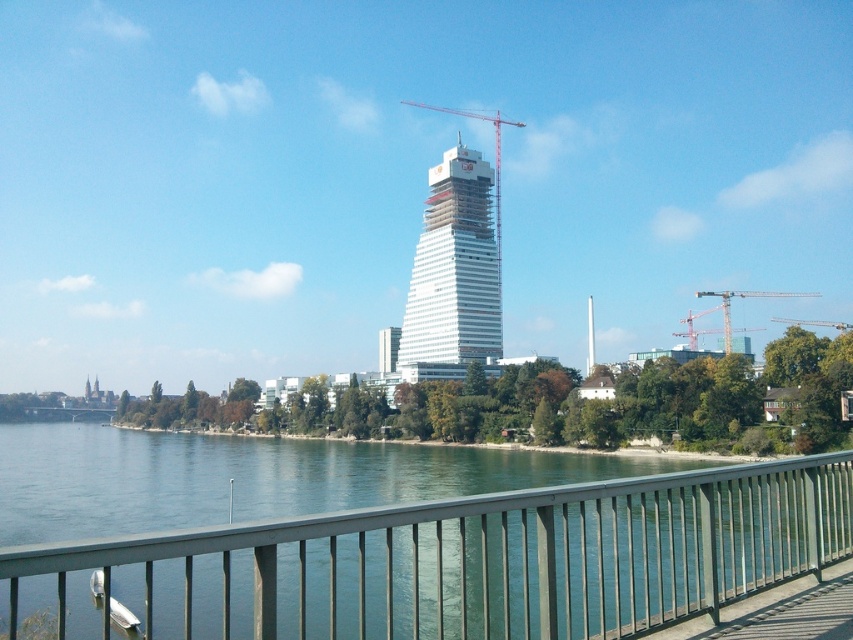
Question: Is metallic gray railing at lower center to the right of white glass building at center from the viewer's perspective?

Choices:
 (A) yes
 (B) no

Answer: (B)

Question: Among these points, which one is farthest from the camera?

Choices:
 (A) (695, 296)
 (B) (792, 468)
 (C) (447, 362)

Answer: (A)

Question: Which object appears farthest from the camera in this image?

Choices:
 (A) white glass building at center
 (B) metallic gray railing at lower center

Answer: (A)

Question: Can you confirm if metallic gray railing at lower center is positioned above metallic gray crane at center?

Choices:
 (A) no
 (B) yes

Answer: (A)

Question: Does metallic gray railing at lower center appear under metallic gray crane at center?

Choices:
 (A) no
 (B) yes

Answer: (B)

Question: Estimate the real-world distances between objects in this image. Which object is farther from the metallic gray railing at lower center?

Choices:
 (A) metallic construction crane at right
 (B) metallic gray crane at center

Answer: (B)